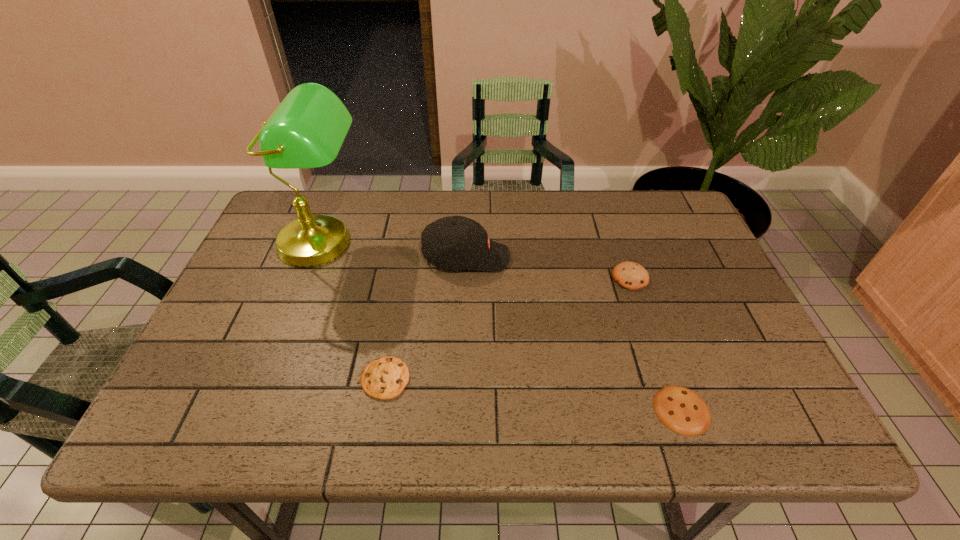
The width and height of the screenshot is (960, 540). Find the location of `lamp`. lamp is located at coordinates (306, 130).

At what (x,y) coordinates should I click in order to perform the action: click on the leftmost object. Please return your answer as a coordinate pair (x, y). Looking at the image, I should click on (306, 130).

Identify the location of baseball cap. (456, 242).

The image size is (960, 540). What are the coordinates of `the farthest cookie` in the screenshot? It's located at (629, 275).

Locate an element on the screen. the tallest cookie is located at coordinates (629, 275).

What are the coordinates of `the leftmost cookie` in the screenshot? It's located at tap(384, 378).

You are a GUI agent. You are given a task and a screenshot of the screen. Output one action in this format:
    pyautogui.click(x=<x>, y=<y>)
    Task: Click on the shortest object
    
    Given the screenshot: What is the action you would take?
    pyautogui.click(x=683, y=411)

Locate an element on the screen. free region located 0.260m on the desk next to the lamp is located at coordinates (277, 363).

Find the location of a particular element. Image resolution: width=960 pixels, height=540 pixels. vacant space located with a logo on the front of the baseball cap is located at coordinates (636, 258).

Where is `vacant space located 0.300m on the front of the tallest cookie`? Image resolution: width=960 pixels, height=540 pixels. vacant space located 0.300m on the front of the tallest cookie is located at coordinates 670,395.